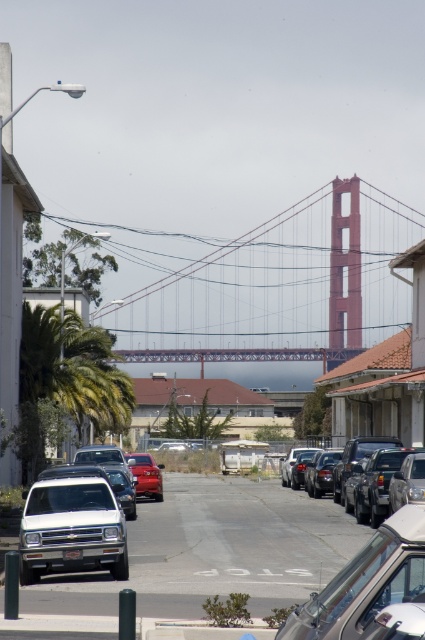
You are a photographer standing on the street and want to take a photo of the red painted steel golden gate bridge at center and the clear glass car at center. Which object should you focus on first if you want both to be in sharp focus?

You should focus on the red painted steel golden gate bridge at center first because it is closer to you than the clear glass car at center, so focusing on the closer object ensures both will be in focus when using a small aperture.

You are a delivery driver who needs to park your vehicle in the parking lot near the clear glass car at center and white matte truck at center. Based on their positions, which vehicle should you park behind to ensure your vehicle is hidden from the view of someone looking from the street?

You should park behind the clear glass car at center because it is positioned over the white matte truck at center, meaning it is closer to the street and would block the view of vehicles behind it.